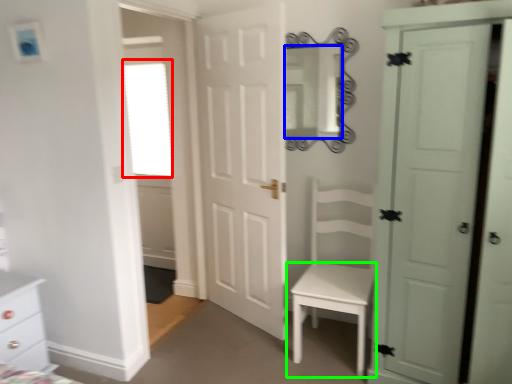
Question: Based on their relative distances, which object is nearer to window (highlighted by a red box)? Choose from mirror (highlighted by a blue box) and table (highlighted by a green box).

Choices:
 (A) mirror
 (B) table

Answer: (A)